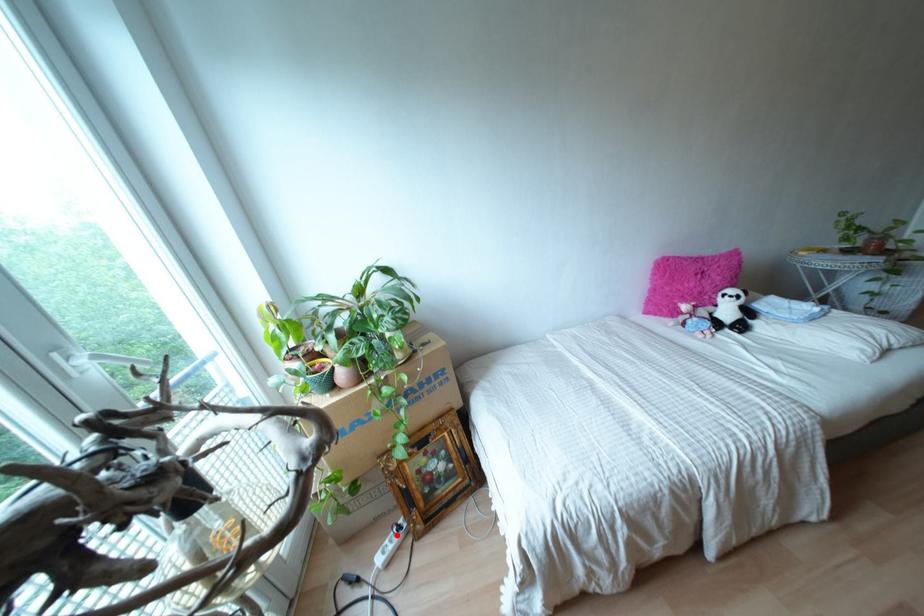
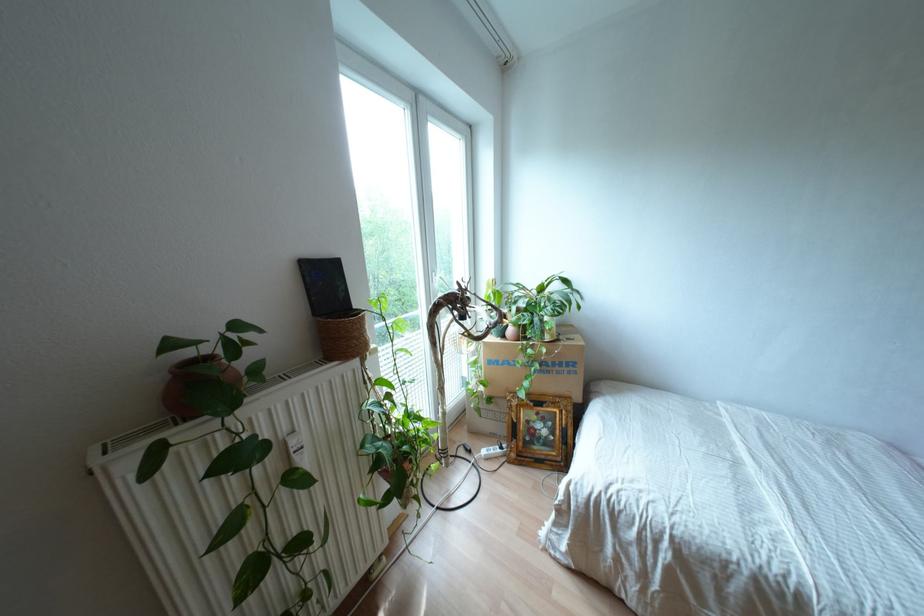
Question: I am providing you with two images of the same scene from different viewpoints. In image1, a red point is highlighted. Considering the same 3D point in image2, which of the following is correct?

Choices:
 (A) It is closer
 (B) It is farther

Answer: (A)